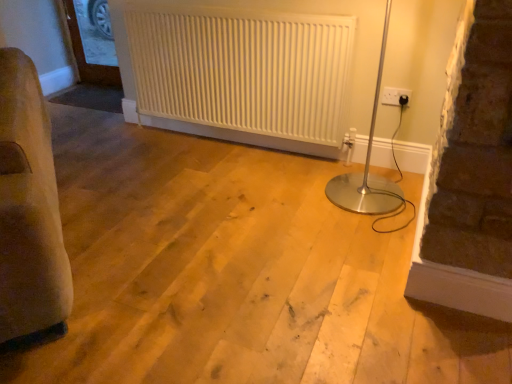
The height and width of the screenshot is (384, 512). Identify the location of vacant area situated to the left side of clear glass door at upper left. (80, 81).